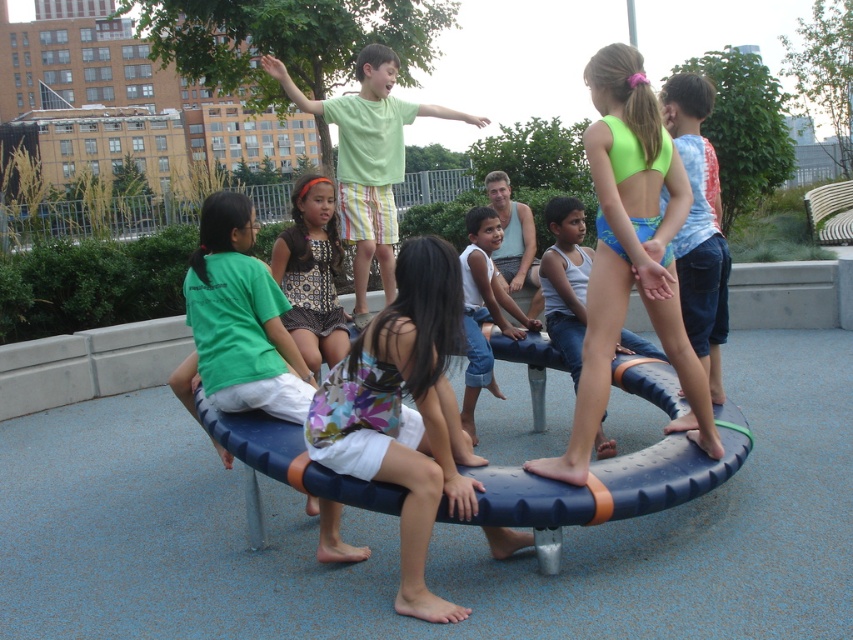
Question: Which point is farther from the camera taking this photo?

Choices:
 (A) (254, 404)
 (B) (524, 333)
 (C) (408, 314)
 (D) (292, 269)

Answer: (B)

Question: Is the position of green matte shirt at upper center less distant than that of white denim shorts at center?

Choices:
 (A) yes
 (B) no

Answer: (B)

Question: Is floral fabric dress at center to the right of blue textured shorts at center from the viewer's perspective?

Choices:
 (A) yes
 (B) no

Answer: (B)

Question: Which of the following is the farthest from the observer?

Choices:
 (A) white denim shorts at center
 (B) green matte shirt at upper center
 (C) blue textured shorts at center
 (D) dotted fabric dress at center

Answer: (B)

Question: Which point is closer to the camera taking this photo?

Choices:
 (A) (x=302, y=202)
 (B) (x=401, y=589)

Answer: (B)

Question: Can you confirm if floral fabric dress at center is bigger than blue denim shorts at center?

Choices:
 (A) yes
 (B) no

Answer: (B)